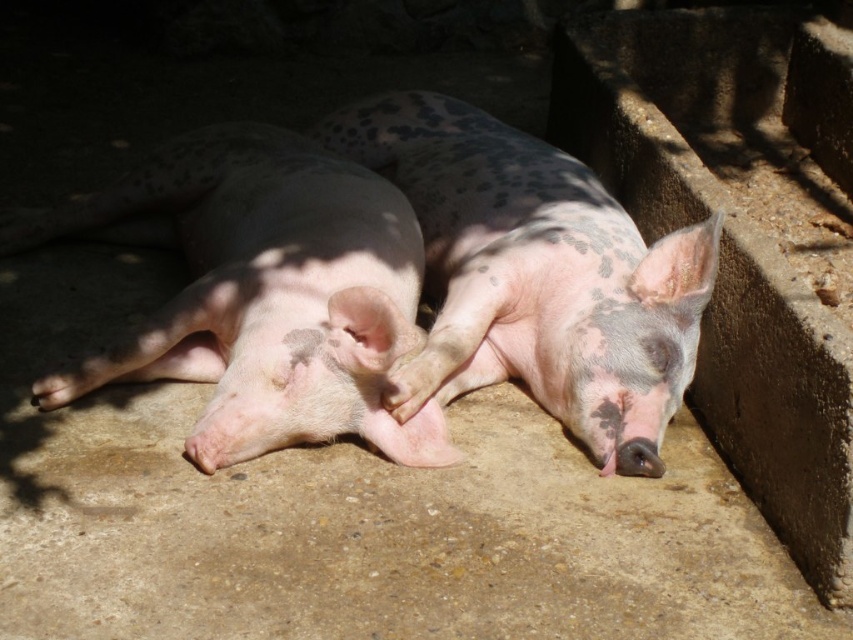
Is pink matte pig at center to the left of pink matte/speckled pig at center from the viewer's perspective?

Correct, you'll find pink matte pig at center to the left of pink matte/speckled pig at center.

What do you see at coordinates (264, 292) in the screenshot? The image size is (853, 640). I see `pink matte pig at center` at bounding box center [264, 292].

Does point (358, 204) come farther from viewer compared to point (335, 131)?

No, it is not.

Find the location of a particular element. pink matte pig at center is located at coordinates (264, 292).